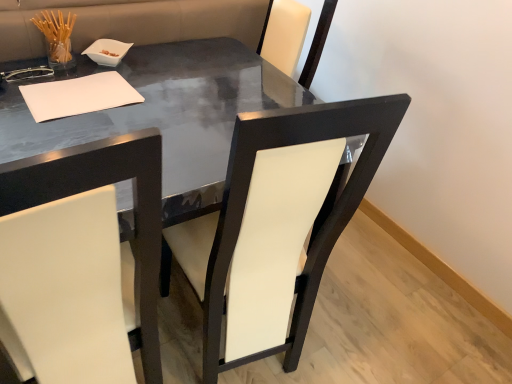
What do you see at coordinates (78, 96) in the screenshot?
I see `white paper at upper left` at bounding box center [78, 96].

The image size is (512, 384). What do you see at coordinates (168, 113) in the screenshot?
I see `glossy black table at center` at bounding box center [168, 113].

Locate an element on the screen. The width and height of the screenshot is (512, 384). white paper at upper left is located at coordinates (78, 96).

From the image's perspective, which one is positioned lower, glossy black table at center or white leather chair at left, which is the first chair in left-to-right order?

white leather chair at left, which is the first chair in left-to-right order, appears lower in the image.

Does glossy black table at center turn towards white leather chair at left, which is the first chair in left-to-right order?

Yes, glossy black table at center is turned towards white leather chair at left, which is the first chair in left-to-right order.

From a real-world perspective, starting from the glossy black table at center, which chair is the 1st one vertically above it? Please provide its 2D coordinates.

[(104, 185)]

In the scene shown: Between glossy black table at center and white leather chair at left, positioned as the second chair in right-to-left order, which one has smaller size?

Smaller between the two is white leather chair at left, positioned as the second chair in right-to-left order.

Which point is more distant from viewer, (85, 111) or (29, 152)?

The point (85, 111) is farther.

Locate an element on the screen. This screenshot has width=512, height=384. notepad above the glossy black table at center (from the image's perspective) is located at coordinates (78, 96).

Is white paper at upper left shorter than glossy black table at center?

Yes.

Which of these two, white paper at upper left or glossy black table at center, is thinner?

white paper at upper left is thinner.

Which of these two, white leather chair at left, which is the first chair in left-to-right order, or white paper at upper left, stands shorter?

With less height is white paper at upper left.

Is white leather chair at left, positioned as the second chair in right-to-left order, far from white paper at upper left?

No.

From a real-world perspective, is white leather chair at left, positioned as the second chair in right-to-left order, positioned above or below white paper at upper left?

white leather chair at left, positioned as the second chair in right-to-left order, is below white paper at upper left.

Which is more to the left, white leather chair at left, which is the first chair in left-to-right order, or white paper at upper left?

Positioned to the left is white paper at upper left.

Who is bigger, white leather chair at left, which is the first chair in left-to-right order, or white leather chair at center, arranged as the 2th chair when viewed from the left?

With larger size is white leather chair at center, arranged as the 2th chair when viewed from the left.

Which object is more forward, white leather chair at left, which is the first chair in left-to-right order, or white leather chair at center, arranged as the 2th chair when viewed from the left?

white leather chair at left, which is the first chair in left-to-right order, is more forward.

Would you say white leather chair at center, arranged as the 2th chair when viewed from the left, is part of white leather chair at left, which is the first chair in left-to-right order,'s contents?

No, white leather chair at center, arranged as the 2th chair when viewed from the left, is not inside white leather chair at left, which is the first chair in left-to-right order.

Could you measure the distance between white leather chair at left, which is the first chair in left-to-right order, and white leather chair at center, arranged as the 2th chair when viewed from the left?

white leather chair at left, which is the first chair in left-to-right order, and white leather chair at center, arranged as the 2th chair when viewed from the left, are 10.40 inches apart.

How many degrees apart are the facing directions of white leather chair at left, which is the first chair in left-to-right order, and glossy black table at center?

white leather chair at left, which is the first chair in left-to-right order, and glossy black table at center are facing 178 degrees away from each other.

From the image's perspective, is white leather chair at left, which is the first chair in left-to-right order, under glossy black table at center?

Indeed, from the image's perspective, white leather chair at left, which is the first chair in left-to-right order, is shown beneath glossy black table at center.

Can you confirm if white leather chair at left, which is the first chair in left-to-right order, is taller than glossy black table at center?

Correct, white leather chair at left, which is the first chair in left-to-right order, is much taller as glossy black table at center.

Which object is more forward, white leather chair at left, positioned as the second chair in right-to-left order, or glossy black table at center?

white leather chair at left, positioned as the second chair in right-to-left order, is in front.

Is white leather chair at center, which is counted as the 1th chair, starting from the right, not close to white leather chair at left, which is the first chair in left-to-right order?

No.

Which of these two, white leather chair at center, arranged as the 2th chair when viewed from the left, or white leather chair at left, which is the first chair in left-to-right order, is bigger?

white leather chair at center, arranged as the 2th chair when viewed from the left, is bigger.

From a real-world perspective, is white leather chair at center, arranged as the 2th chair when viewed from the left, positioned under white leather chair at left, positioned as the second chair in right-to-left order, based on gravity?

Incorrect, from a real-world perspective, white leather chair at center, arranged as the 2th chair when viewed from the left, is higher than white leather chair at left, positioned as the second chair in right-to-left order.

Identify the location of the 1st chair positioned below the white paper at upper left (from the image's perspective). (277, 224).

From a real-world perspective, is white leather chair at center, which is counted as the 1th chair, starting from the right, positioned under white paper at upper left based on gravity?

Correct, in the physical world, white leather chair at center, which is counted as the 1th chair, starting from the right, is lower than white paper at upper left.

Is white leather chair at center, which is counted as the 1th chair, starting from the right, positioned behind white paper at upper left?

No, it is not.

Can you confirm if white leather chair at center, arranged as the 2th chair when viewed from the left, is smaller than white paper at upper left?

No, white leather chair at center, arranged as the 2th chair when viewed from the left, is not smaller than white paper at upper left.

Image resolution: width=512 pixels, height=384 pixels. Find the location of `chair to the left of glossy black table at center`. chair to the left of glossy black table at center is located at coordinates (104, 185).

Where is `table located in front of the white paper at upper left`? The height and width of the screenshot is (384, 512). table located in front of the white paper at upper left is located at coordinates (168, 113).

In the scene shown: Estimate the real-world distances between objects in this image. Which object is closer to white leather chair at center, which is counted as the 1th chair, starting from the right, white leather chair at left, positioned as the second chair in right-to-left order, or glossy black table at center?

white leather chair at left, positioned as the second chair in right-to-left order.

In the scene shown: When comparing their distances from white leather chair at left, which is the first chair in left-to-right order, does white paper at upper left or glossy black table at center seem closer?

glossy black table at center is closer to white leather chair at left, which is the first chair in left-to-right order.

Considering their positions, is glossy black table at center positioned further to white paper at upper left than white leather chair at left, positioned as the second chair in right-to-left order?

Among the two, white leather chair at left, positioned as the second chair in right-to-left order, is located further to white paper at upper left.

From the image, which object appears to be nearer to white leather chair at center, arranged as the 2th chair when viewed from the left, white paper at upper left or glossy black table at center?

Based on the image, glossy black table at center appears to be nearer to white leather chair at center, arranged as the 2th chair when viewed from the left.

When comparing their distances from white leather chair at left, positioned as the second chair in right-to-left order, does white paper at upper left or white leather chair at center, arranged as the 2th chair when viewed from the left, seem further?

The object further to white leather chair at left, positioned as the second chair in right-to-left order, is white paper at upper left.

Considering their positions, is white paper at upper left positioned closer to glossy black table at center than white leather chair at left, which is the first chair in left-to-right order?

Among the two, white paper at upper left is located nearer to glossy black table at center.

Estimate the real-world distances between objects in this image. Which object is further from white paper at upper left, glossy black table at center or white leather chair at center, arranged as the 2th chair when viewed from the left?

Among the two, white leather chair at center, arranged as the 2th chair when viewed from the left, is located further to white paper at upper left.

Looking at the image, which one is located further to white leather chair at center, which is counted as the 1th chair, starting from the right, white paper at upper left or white leather chair at left, positioned as the second chair in right-to-left order?

white paper at upper left is positioned further to the anchor white leather chair at center, which is counted as the 1th chair, starting from the right.

You are a GUI agent. You are given a task and a screenshot of the screen. Output one action in this format:
    pyautogui.click(x=<x>, y=<y>)
    Task: Click on the table between white leather chair at center, which is counted as the 1th chair, starting from the right, and white paper at upper left from front to back
    Image resolution: width=512 pixels, height=384 pixels.
    Given the screenshot: What is the action you would take?
    pyautogui.click(x=168, y=113)

Locate an element on the screen. This screenshot has width=512, height=384. chair between white leather chair at left, which is the first chair in left-to-right order, and white paper at upper left in the front-back direction is located at coordinates (277, 224).

Where is `table positioned between white leather chair at left, positioned as the second chair in right-to-left order, and white paper at upper left from near to far`? table positioned between white leather chair at left, positioned as the second chair in right-to-left order, and white paper at upper left from near to far is located at coordinates (168, 113).

Identify the location of table between white leather chair at left, which is the first chair in left-to-right order, and white leather chair at center, which is counted as the 1th chair, starting from the right. The image size is (512, 384). (168, 113).